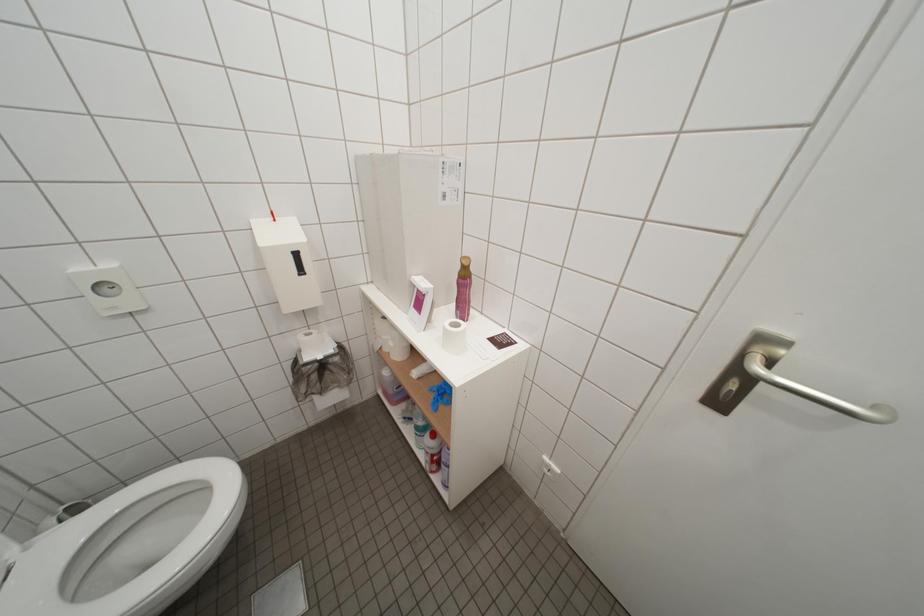
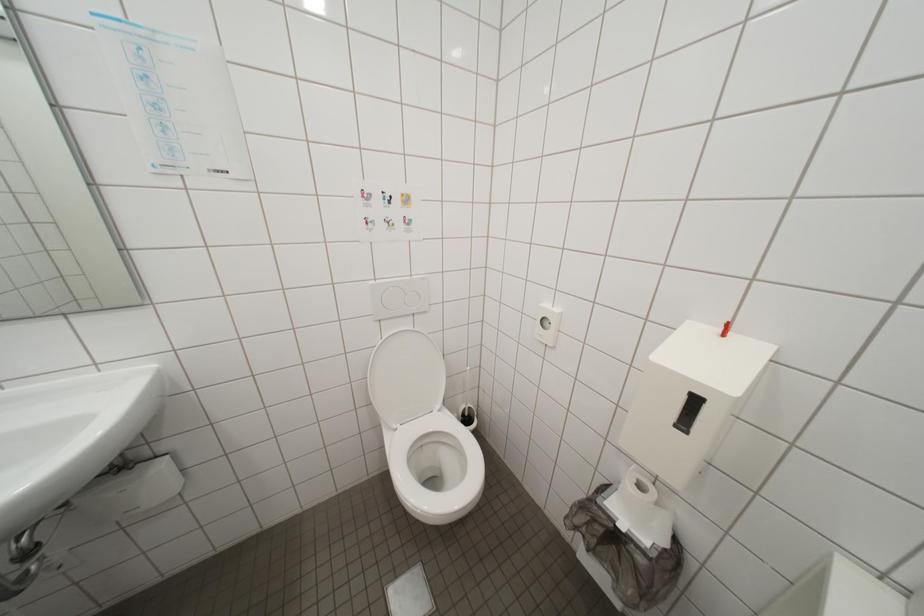
Based on the photo, the first image is from the beginning of the video and the second image is from the end. How did the camera likely rotate when shooting the video?

The rotation direction of the camera is left-down.